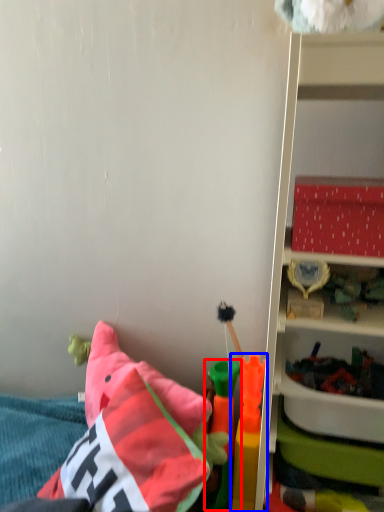
Question: Which of the following is the closest to the observer, toy (highlighted by a red box) or toy (highlighted by a blue box)?

Choices:
 (A) toy
 (B) toy

Answer: (B)